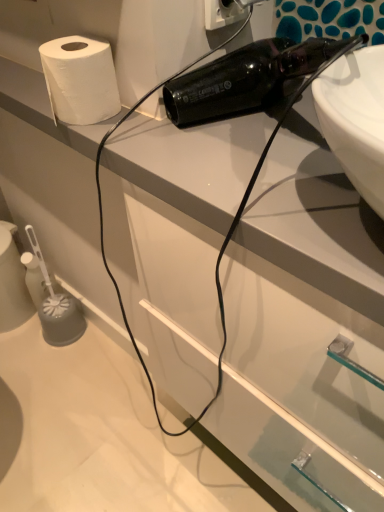
Question: Is white plastic electric outlet at upper center at the left side of white matte paper towel at upper left?

Choices:
 (A) yes
 (B) no

Answer: (B)

Question: Is white plastic electric outlet at upper center bigger than white matte paper towel at upper left?

Choices:
 (A) yes
 (B) no

Answer: (B)

Question: Is white plastic electric outlet at upper center at the right side of white matte paper towel at upper left?

Choices:
 (A) yes
 (B) no

Answer: (A)

Question: From a real-world perspective, does white plastic electric outlet at upper center sit lower than white matte paper towel at upper left?

Choices:
 (A) yes
 (B) no

Answer: (B)

Question: Can you confirm if white plastic electric outlet at upper center is shorter than white matte paper towel at upper left?

Choices:
 (A) no
 (B) yes

Answer: (A)

Question: From a real-world perspective, is white plastic electric outlet at upper center positioned over white matte paper towel at upper left based on gravity?

Choices:
 (A) no
 (B) yes

Answer: (B)

Question: From the image's perspective, is white matte paper towel at upper left beneath white plastic electric outlet at upper center?

Choices:
 (A) yes
 (B) no

Answer: (A)

Question: From a real-world perspective, is white matte paper towel at upper left beneath white plastic electric outlet at upper center?

Choices:
 (A) no
 (B) yes

Answer: (B)

Question: From a real-world perspective, is white matte paper towel at upper left located higher than white plastic electric outlet at upper center?

Choices:
 (A) no
 (B) yes

Answer: (A)

Question: Can you confirm if white matte paper towel at upper left is bigger than white plastic electric outlet at upper center?

Choices:
 (A) no
 (B) yes

Answer: (B)

Question: Does white matte paper towel at upper left have a lesser width compared to white plastic electric outlet at upper center?

Choices:
 (A) yes
 (B) no

Answer: (B)

Question: From the image's perspective, is white matte paper towel at upper left on top of white plastic electric outlet at upper center?

Choices:
 (A) yes
 (B) no

Answer: (B)

Question: Looking at their shapes, would you say white plastic electric outlet at upper center is wider or thinner than white matte paper towel at upper left?

Choices:
 (A) thin
 (B) wide

Answer: (A)